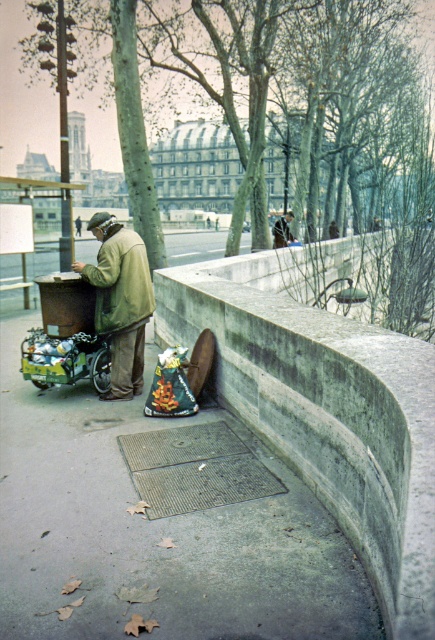
Describe the element at coordinates (154, 532) in the screenshot. The height and width of the screenshot is (640, 435). I see `concrete pavement at lower left` at that location.

Which is behind, point (234, 552) or point (295, 337)?

Positioned behind is point (295, 337).

Identify the location of concrete pavement at lower left. The height and width of the screenshot is (640, 435). (154, 532).

Is concrete ledge at lower center taller than light brown leather jacket at upper center?

Yes, concrete ledge at lower center is taller than light brown leather jacket at upper center.

In the scene shown: Does concrete ledge at lower center appear on the right side of light brown leather jacket at upper center?

Incorrect, concrete ledge at lower center is not on the right side of light brown leather jacket at upper center.

Locate an element on the screen. The height and width of the screenshot is (640, 435). concrete ledge at lower center is located at coordinates (324, 410).

Between concrete pavement at lower left and light brown leather jacket at upper center, which one has less height?

concrete pavement at lower left

Who is more distant from viewer, (70,593) or (274,234)?

Point (274,234)

What do you see at coordinates (154, 532) in the screenshot?
I see `concrete pavement at lower left` at bounding box center [154, 532].

Locate an element on the screen. This screenshot has height=640, width=435. concrete pavement at lower left is located at coordinates (154, 532).